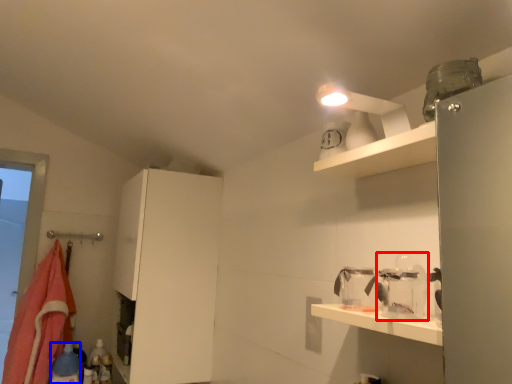
Question: Which point is closer to the camera, glass jar (highlighted by a red box) or bottle (highlighted by a blue box)?

Choices:
 (A) glass jar
 (B) bottle

Answer: (A)